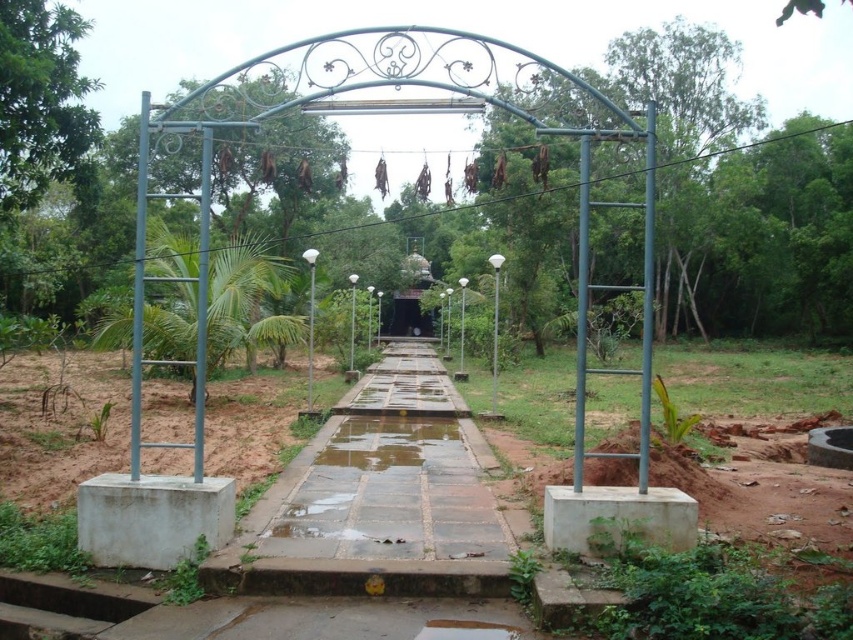
Question: From the image, what is the correct spatial relationship of wet concrete path at center in relation to glossy concrete puddle at center?

Choices:
 (A) left
 (B) right

Answer: (B)

Question: Which object appears closest to the camera in this image?

Choices:
 (A) glossy concrete puddle at center
 (B) wet concrete path at center

Answer: (B)

Question: Which of the following is the closest to the observer?

Choices:
 (A) wet concrete path at center
 (B) glossy concrete puddle at center

Answer: (A)

Question: Which of the following is the closest to the observer?

Choices:
 (A) (329, 440)
 (B) (386, 429)

Answer: (A)

Question: Can you confirm if wet concrete path at center is bigger than glossy concrete puddle at center?

Choices:
 (A) yes
 (B) no

Answer: (A)

Question: Does wet concrete path at center appear under glossy concrete puddle at center?

Choices:
 (A) no
 (B) yes

Answer: (A)